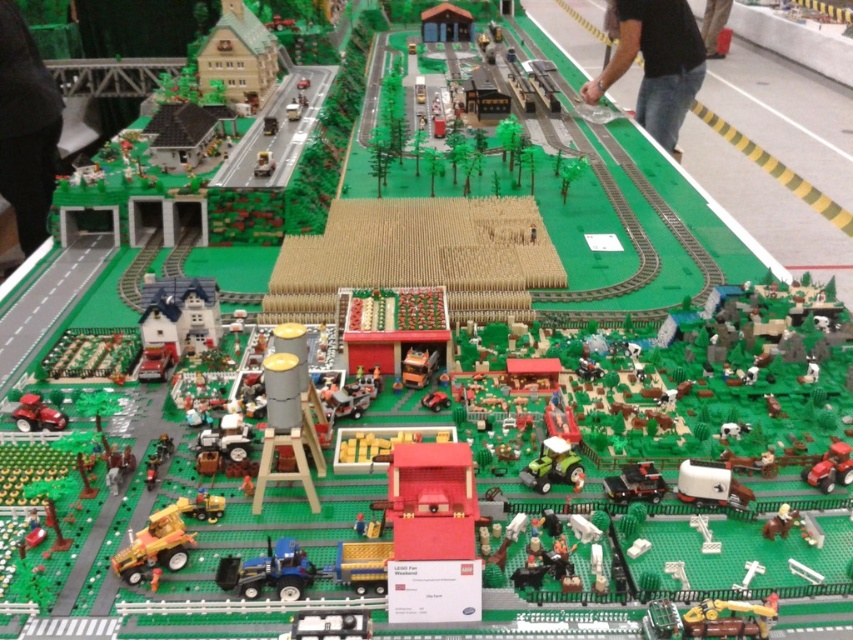
Between yellow plastic tractor at lower left and metallic silver car at upper left, which one appears on the left side from the viewer's perspective?

metallic silver car at upper left is more to the left.

Between point (154, 524) and point (268, 173), which one is positioned in front?

Point (154, 524) is in front.

The height and width of the screenshot is (640, 853). What are the coordinates of `yellow plastic tractor at lower left` in the screenshot? It's located at (154, 547).

How much distance is there between yellow plastic tractor at lower left and matte red tractor at lower right?

yellow plastic tractor at lower left is 29.03 inches away from matte red tractor at lower right.

Based on the photo, does yellow plastic tractor at lower left have a greater height compared to matte red tractor at lower right?

Yes, yellow plastic tractor at lower left is taller than matte red tractor at lower right.

Is point (166, 525) more distant than point (831, 468)?

No, it is not.

This screenshot has height=640, width=853. Find the location of `yellow plastic tractor at lower left`. yellow plastic tractor at lower left is located at coordinates tap(154, 547).

From the picture: Which is below, green matte tractor at center or metallic silver car at upper left?

green matte tractor at center is lower down.

Is green matte tractor at center smaller than metallic silver car at upper left?

Yes.

Which is behind, point (546, 467) or point (268, 173)?

The point (268, 173) is behind.

In order to click on green matte tractor at center in this screenshot , I will do `click(553, 467)`.